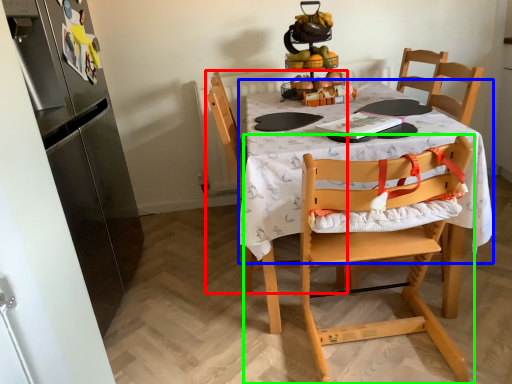
Question: Which object is positioned farthest from chair (highlighted by a red box)? Select from round table (highlighted by a blue box) and chair (highlighted by a green box).

Choices:
 (A) round table
 (B) chair

Answer: (B)